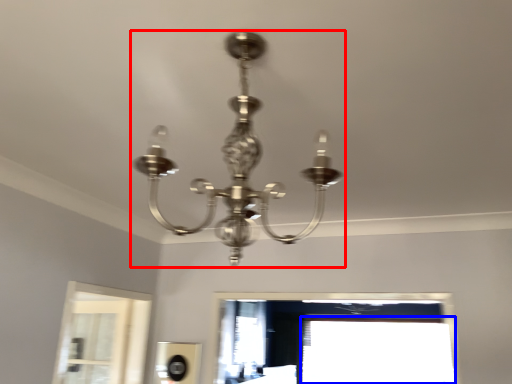
Question: Which object is further to the camera taking this photo, lamp (highlighted by a red box) or window (highlighted by a blue box)?

Choices:
 (A) lamp
 (B) window

Answer: (B)